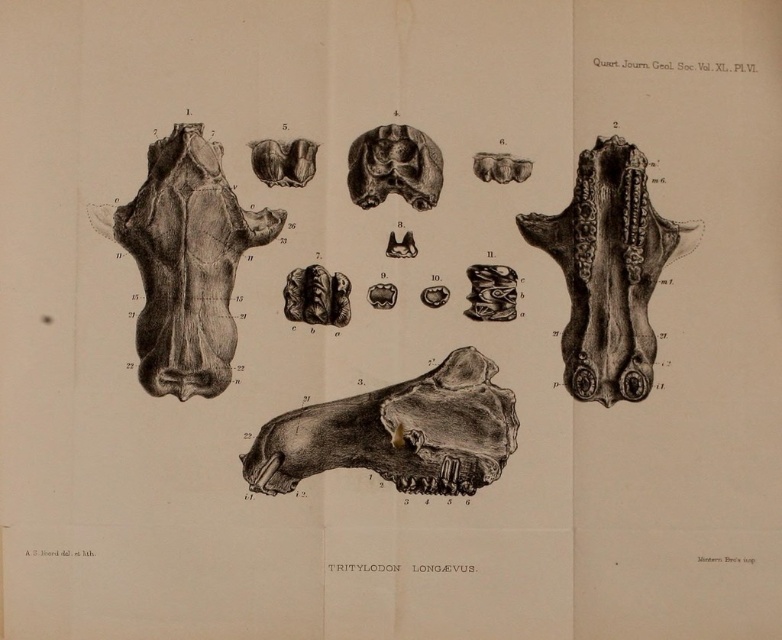
Describe the element at coordinates (185, 262) in the screenshot. I see `black bone skull at upper left` at that location.

Is black bone skull at upper left taller than black textured skull at center?

Correct, black bone skull at upper left is much taller as black textured skull at center.

Does point (230, 192) lie in front of point (354, 150)?

Yes, it is in front of point (354, 150).

What are the coordinates of `black bone skull at upper left` in the screenshot? It's located at (185, 262).

Is point (630, 273) closer to camera compared to point (375, 164)?

No, it is not.

Does black textured skull at right have a lesser height compared to black textured skull at center?

No, black textured skull at right is not shorter than black textured skull at center.

The height and width of the screenshot is (640, 782). What do you see at coordinates (608, 269) in the screenshot?
I see `black textured skull at right` at bounding box center [608, 269].

Locate an element on the screen. black textured skull at right is located at coordinates (608, 269).

Who is lower down, black bone skull at upper left or black textured skull at right?

black textured skull at right is below.

Can you confirm if black bone skull at upper left is positioned below black textured skull at right?

Incorrect, black bone skull at upper left is not positioned below black textured skull at right.

This screenshot has height=640, width=782. I want to click on black bone skull at upper left, so click(x=185, y=262).